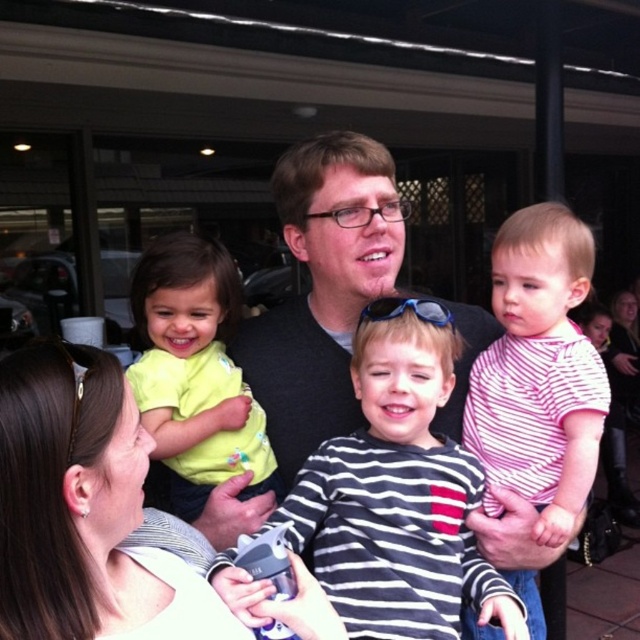
Which is more to the left, black matte shirt at center or light green fabric shirt at left?

light green fabric shirt at left

Is point (282, 404) farther from camera compared to point (161, 451)?

Yes.

This screenshot has height=640, width=640. Identify the location of black matte shirt at center. (323, 289).

Does point (29, 568) come behind point (280, 157)?

No, it is in front of (280, 157).

Who is taller, white matte shirt at center or black matte shirt at center?

black matte shirt at center

Is point (60, 497) closer to camera compared to point (328, 196)?

Yes, it is in front of point (328, 196).

You are a GUI agent. You are given a task and a screenshot of the screen. Output one action in this format:
    pyautogui.click(x=<x>, y=<y>)
    Task: Click on the white matte shirt at center
    
    Given the screenshot: What is the action you would take?
    pyautogui.click(x=84, y=509)

Looking at this image, does white matte shirt at center appear on the right side of light green fabric shirt at left?

Incorrect, white matte shirt at center is not on the right side of light green fabric shirt at left.

From the picture: Which is more to the right, white matte shirt at center or light green fabric shirt at left?

From the viewer's perspective, light green fabric shirt at left appears more on the right side.

Which is behind, point (154, 637) or point (163, 353)?

Point (163, 353)

Where is `white matte shirt at center`? This screenshot has width=640, height=640. white matte shirt at center is located at coordinates (84, 509).